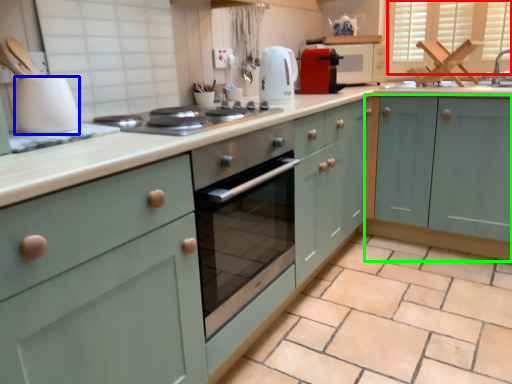
Question: Which object is positioned closest to window (highlighted by a red box)? Select from kitchen appliance (highlighted by a blue box) and cabinetry (highlighted by a green box).

Choices:
 (A) kitchen appliance
 (B) cabinetry

Answer: (B)